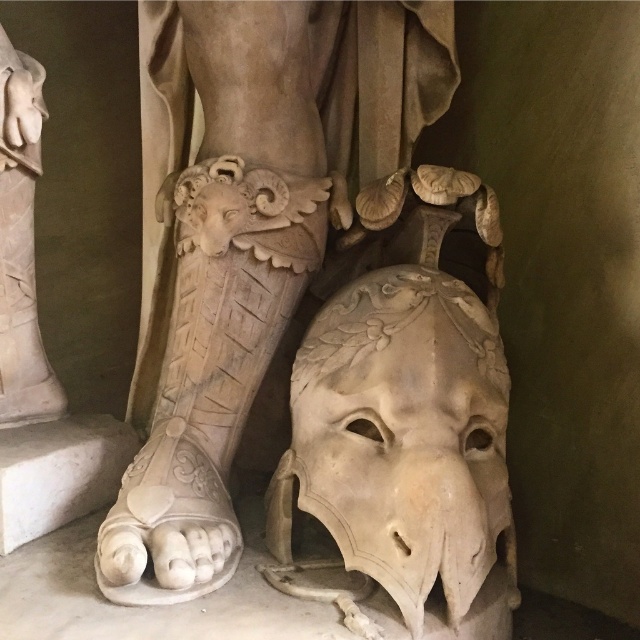
Question: Can you confirm if white marble mask at lower center is smaller than matte stone mask at lower center?

Choices:
 (A) yes
 (B) no

Answer: (B)

Question: In this image, where is white marble mask at lower center located relative to matte stone mask at lower center?

Choices:
 (A) above
 (B) below

Answer: (A)

Question: Which point is farther from the camera taking this photo?

Choices:
 (A) (412, 358)
 (B) (179, 442)

Answer: (B)

Question: Which object appears farthest from the camera in this image?

Choices:
 (A) matte stone mask at lower center
 (B) white marble mask at lower center

Answer: (B)

Question: Is white marble mask at lower center wider than matte stone mask at lower center?

Choices:
 (A) yes
 (B) no

Answer: (A)

Question: Which of the following is the closest to the observer?

Choices:
 (A) (275, 550)
 (B) (198, 154)

Answer: (A)